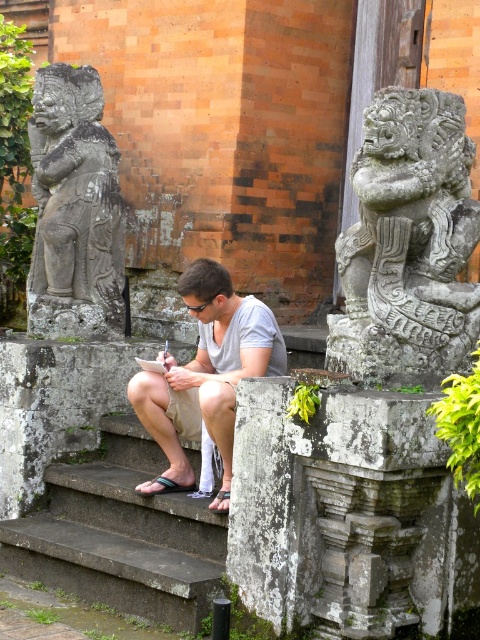
Question: Does carved stone lion at upper right appear over white cotton shirt at center?

Choices:
 (A) no
 (B) yes

Answer: (B)

Question: Which point is closer to the camera?

Choices:
 (A) white cotton shirt at center
 (B) gray stone statue at left
 (C) dark gray stone stairs at center
 (D) carved stone lion at upper right

Answer: (D)

Question: Among these points, which one is nearest to the camera?

Choices:
 (A) [x=453, y=244]
 (B) [x=119, y=529]
 (C) [x=97, y=134]

Answer: (A)

Question: Observing the image, what is the correct spatial positioning of carved stone lion at upper right in reference to dark gray stone stairs at center?

Choices:
 (A) right
 (B) left

Answer: (A)

Question: Where is dark gray stone stairs at center located in relation to gray stone statue at left in the image?

Choices:
 (A) below
 (B) above

Answer: (A)

Question: Which point is farther to the camera?

Choices:
 (A) (272, 364)
 (B) (56, 566)

Answer: (A)